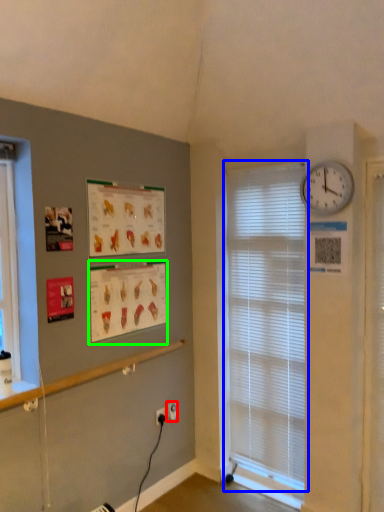
Question: Which is farther away from electric outlet (highlighted by a red box)? window blind (highlighted by a blue box) or poster page (highlighted by a green box)?

Choices:
 (A) window blind
 (B) poster page

Answer: (A)